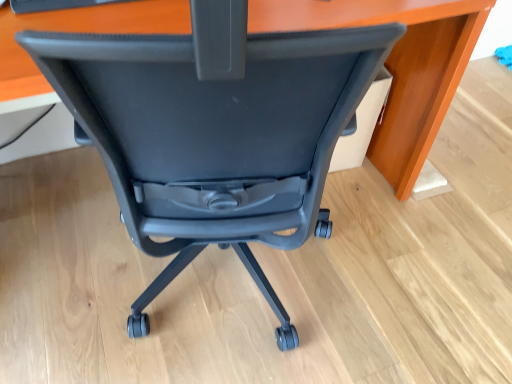
Describe the element at coordinates (215, 131) in the screenshot. Image resolution: width=512 pixels, height=384 pixels. I see `matte black chair at center` at that location.

This screenshot has height=384, width=512. Identify the location of matte black chair at center. (215, 131).

The width and height of the screenshot is (512, 384). Identify the location of matte black chair at center. (215, 131).